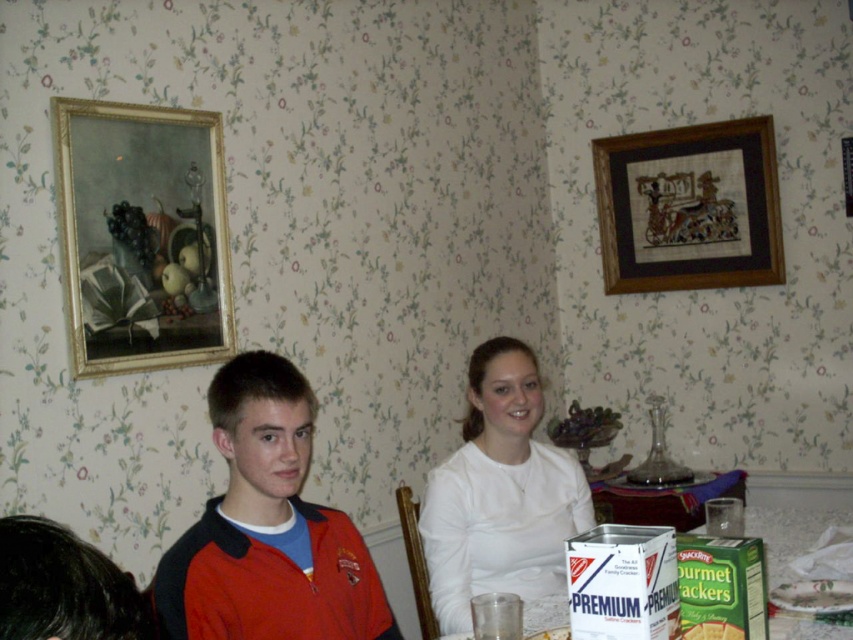
Question: Does gold/gilded picture frame at upper left appear over red jacket at center?

Choices:
 (A) no
 (B) yes

Answer: (B)

Question: Is gold/gilded picture frame at upper left further to the viewer compared to white matte shirt at center?

Choices:
 (A) yes
 (B) no

Answer: (A)

Question: Can you confirm if red jacket at center is positioned to the right of white cardboard box at lower center?

Choices:
 (A) no
 (B) yes

Answer: (A)

Question: Which object is positioned farthest from the white cardboard box at lower center?

Choices:
 (A) gold/gilded picture frame at upper left
 (B) red jacket at center
 (C) wooden framed artwork at upper right
 (D) white matte shirt at center

Answer: (A)

Question: Estimate the real-world distances between objects in this image. Which object is closer to the white matte shirt at center?

Choices:
 (A) white cardboard box at lower center
 (B) gold/gilded picture frame at upper left
 (C) wooden framed artwork at upper right

Answer: (A)

Question: Which object is positioned closest to the white matte shirt at center?

Choices:
 (A) wooden framed artwork at upper right
 (B) red jacket at center

Answer: (B)